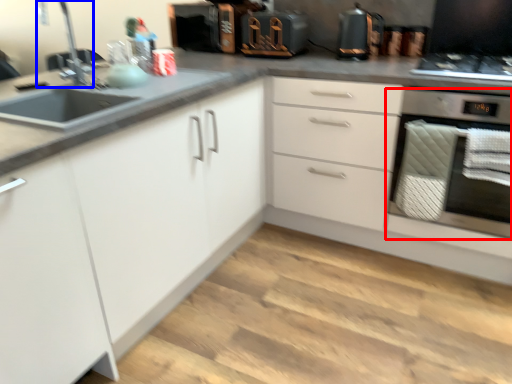
Question: Which point is closer to the camera, home appliance (highlighted by a red box) or faucet (highlighted by a blue box)?

Choices:
 (A) home appliance
 (B) faucet

Answer: (B)